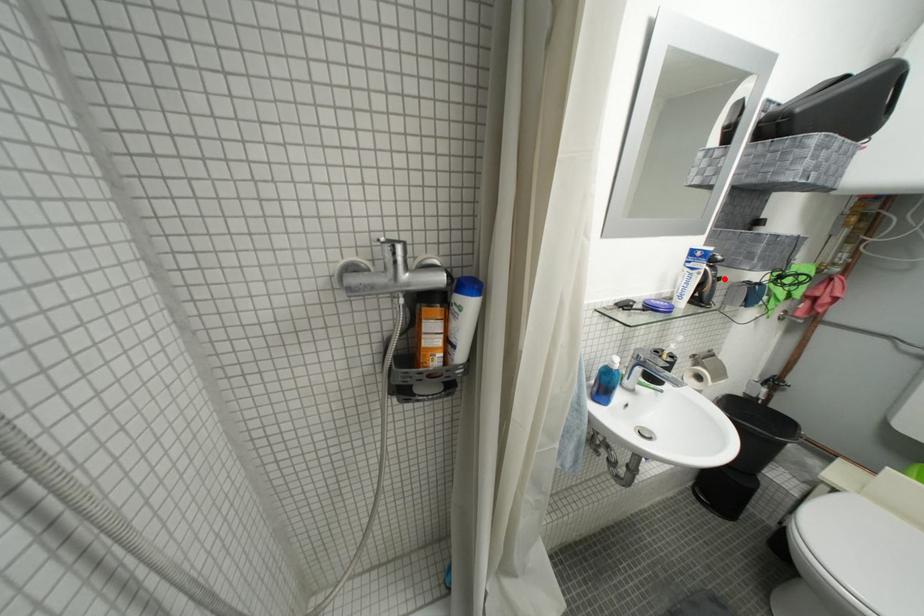
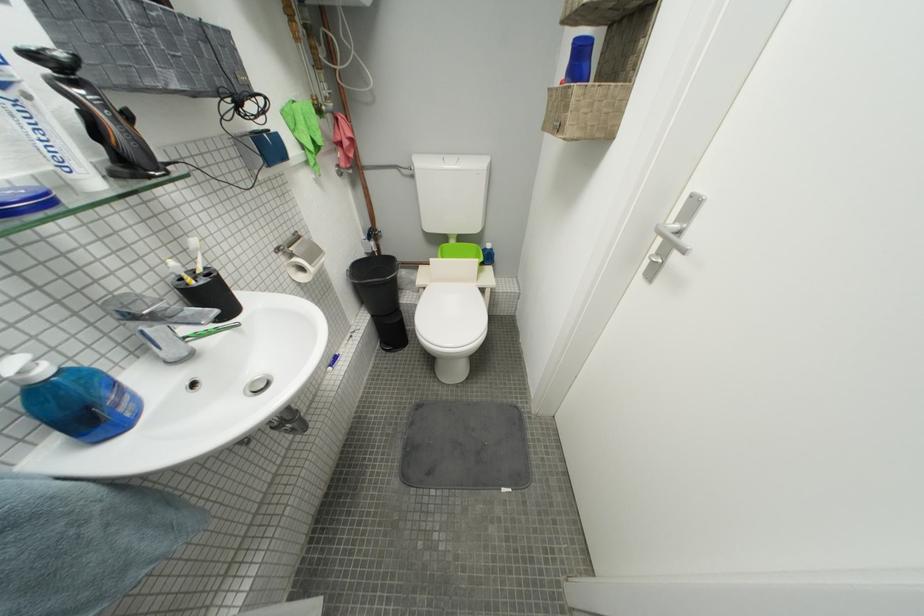
Question: I am providing you with two images of the same scene from different viewpoints. A red point is marked on the first image. Is the red point's position out of view in image 2?

Choices:
 (A) Yes
 (B) No

Answer: (B)